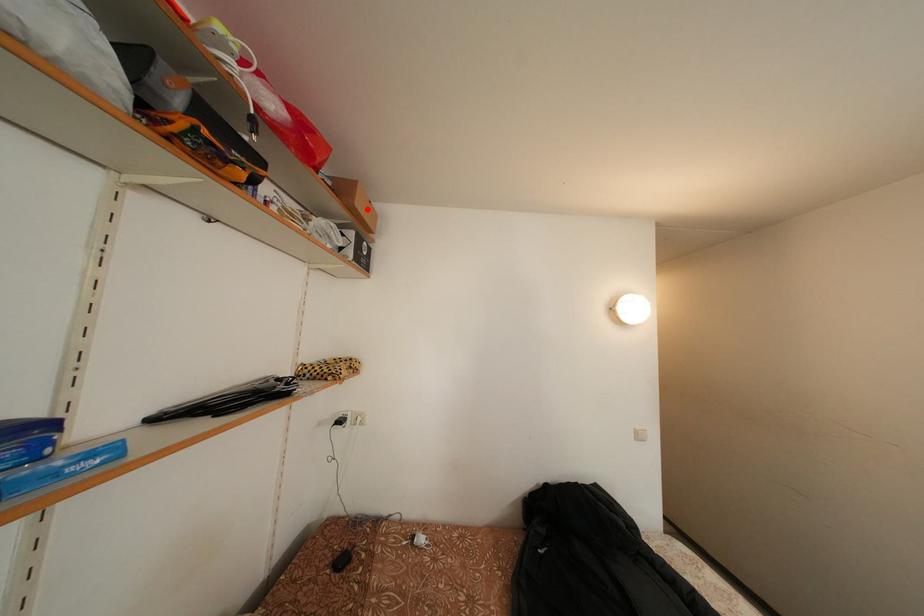
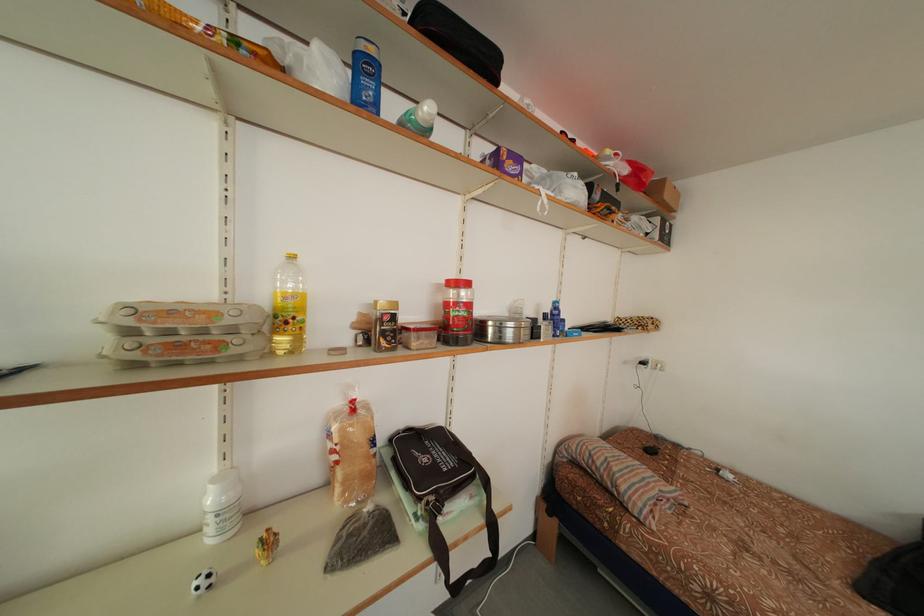
Where in the second image is the point corresponding to the highlighted location from the first image?

(675, 201)